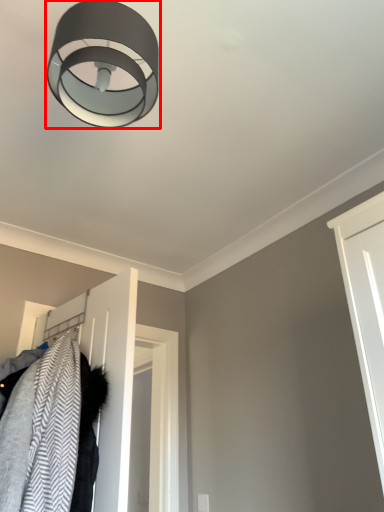
Question: From the image, what is the correct spatial relationship of lamp (annotated by the red box) in relation to door?

Choices:
 (A) left
 (B) right

Answer: (B)